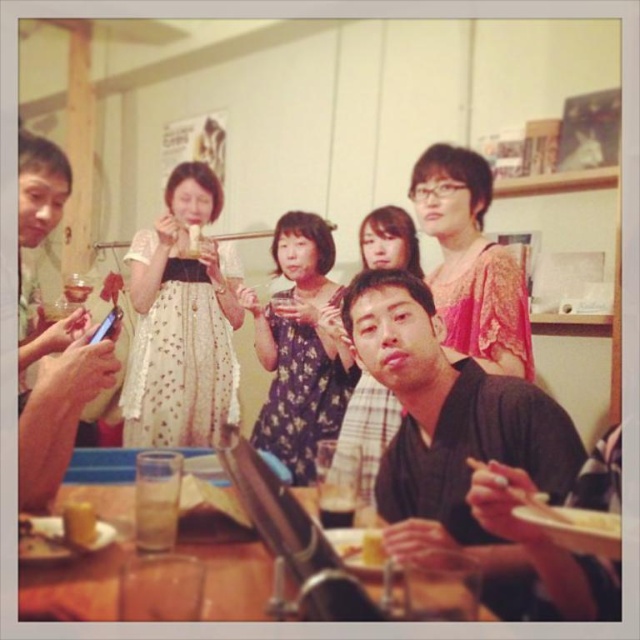
Question: Does black matte kimono at center appear on the left side of yellow matte cupcake at lower left?

Choices:
 (A) no
 (B) yes

Answer: (A)

Question: Is transparent glass table at lower center to the left of clear plastic cup at lower center from the viewer's perspective?

Choices:
 (A) yes
 (B) no

Answer: (A)

Question: Among these objects, which one is nearest to the camera?

Choices:
 (A) yellow matte cake at center
 (B) clear plastic cup at lower center
 (C) clear glass at upper left
 (D) black matte kimono at center

Answer: (D)

Question: Estimate the real-world distances between objects in this image. Which object is farther from the yellow matte cupcake at lower left?

Choices:
 (A) transparent glass table at lower center
 (B) translucent glass at lower left
 (C) clear glass at upper left

Answer: (C)

Question: Considering the real-world distances, which object is closest to the translucent glass at lower left?

Choices:
 (A) yellow matte cake at center
 (B) clear plastic cup at lower center
 (C) transparent glass table at lower center

Answer: (C)

Question: Is translucent glass at lower left thinner than yellow matte rice at lower center?

Choices:
 (A) no
 (B) yes

Answer: (B)